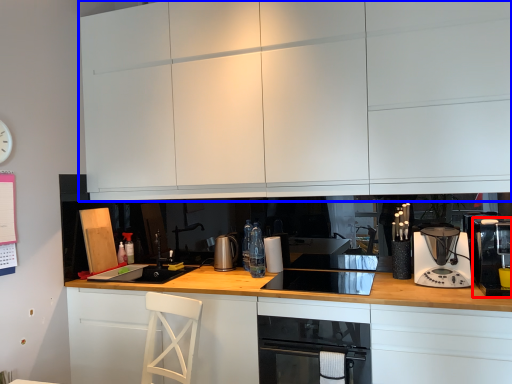
Question: Which object is closer to the camera taking this photo, kitchen appliance (highlighted by a red box) or cabinetry (highlighted by a blue box)?

Choices:
 (A) kitchen appliance
 (B) cabinetry

Answer: (A)